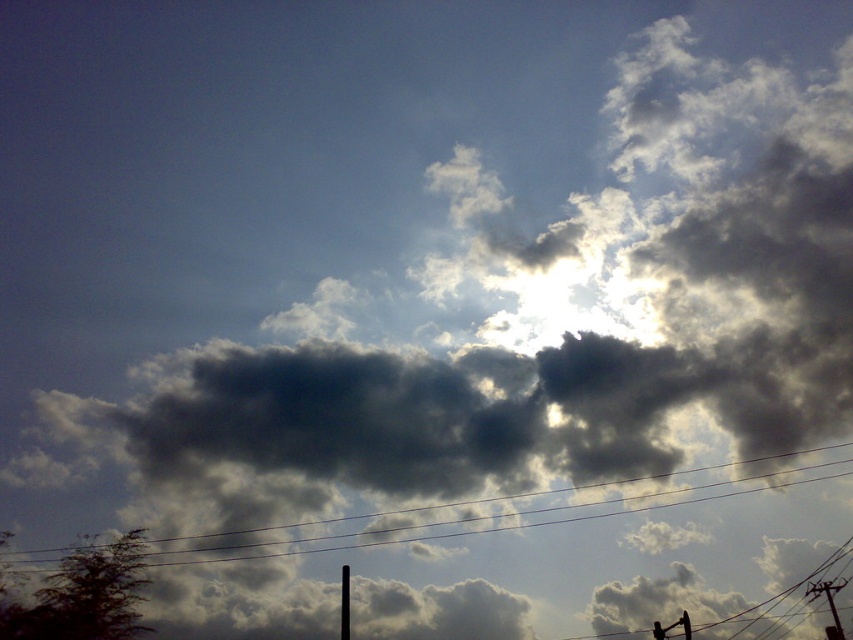
Looking at this image, is black wire at center positioned in front of black metallic pole at lower center?

Yes.

Is black wire at center taller than black metallic pole at lower center?

Correct, black wire at center is much taller as black metallic pole at lower center.

Between point (535, 513) and point (341, 568), which one is positioned in front?

Point (341, 568) is more forward.

Where is `black wire at center`? black wire at center is located at coordinates (486, 499).